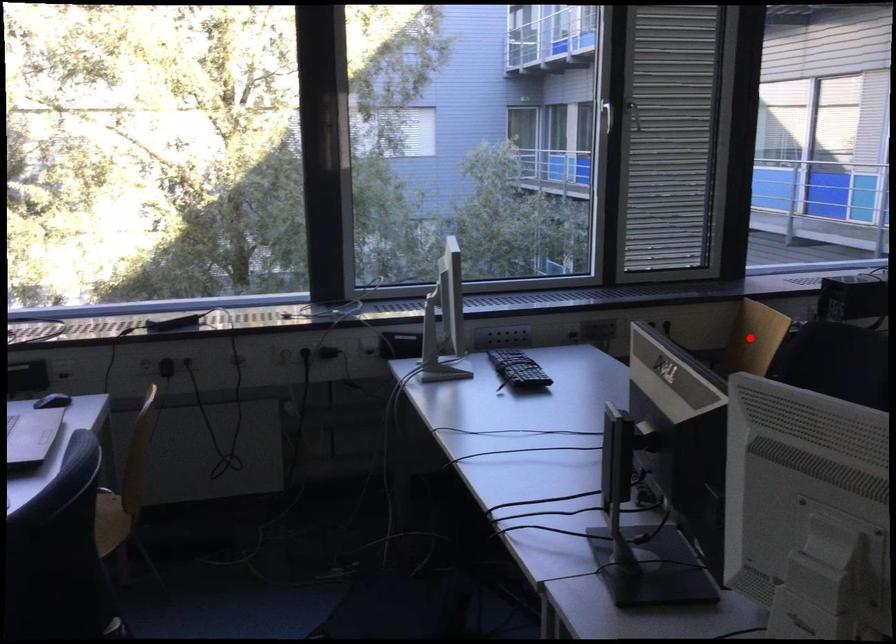
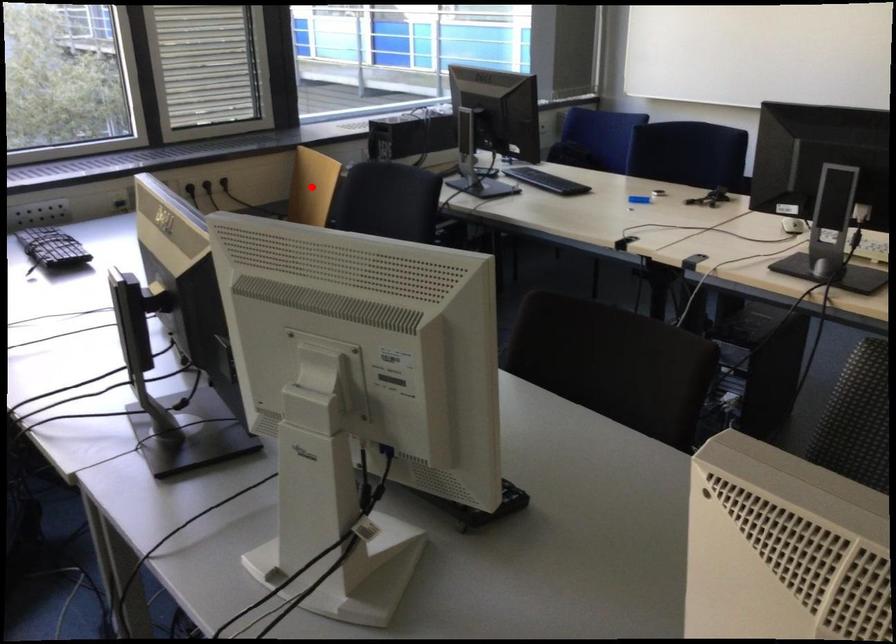
I am providing you with two images of the same scene from different viewpoints. A red point is marked on the first image and another point is marked on the second image. Do the highlighted points in image1 and image2 indicate the same real-world spot?

Yes